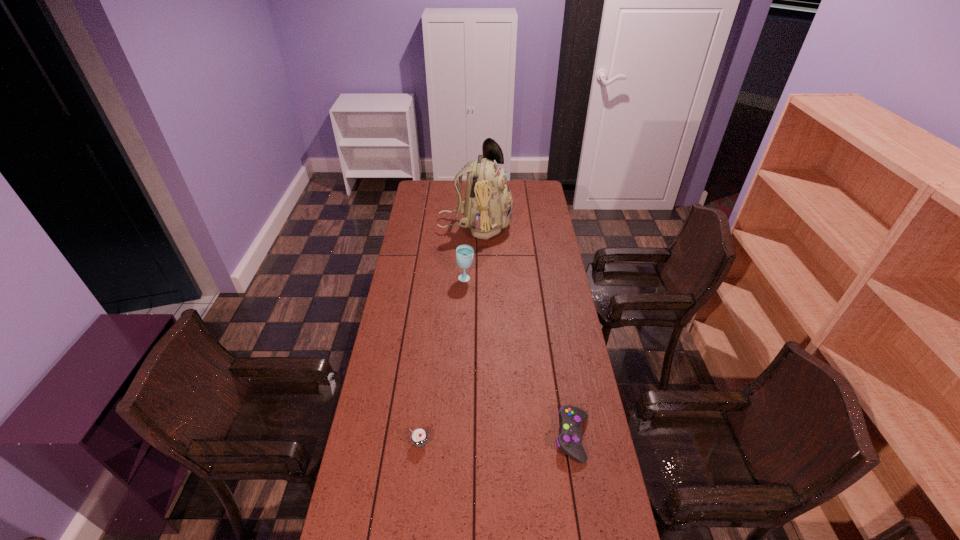
Where is `vacant space located on the back of the rightmost object`? The height and width of the screenshot is (540, 960). vacant space located on the back of the rightmost object is located at coordinates (558, 353).

Find the location of a particular element. Image resolution: width=960 pixels, height=540 pixels. object at the right edge is located at coordinates (569, 441).

What are the coordinates of `free spot at the far edge of the desktop` in the screenshot? It's located at (444, 186).

In the image, there is a desktop. Where is `free space at the left edge`? The image size is (960, 540). free space at the left edge is located at coordinates (366, 437).

Where is `free space at the right edge`? free space at the right edge is located at coordinates (583, 511).

Find the location of `vacant region at the far right corner of the desktop`. vacant region at the far right corner of the desktop is located at coordinates (541, 196).

You are a GUI agent. You are given a task and a screenshot of the screen. Output one action in this format:
    pyautogui.click(x=<x>, y=<y>)
    Task: Click on the free area in between the cupcake and the third nearest object
    
    Given the screenshot: What is the action you would take?
    pyautogui.click(x=443, y=361)

You are a GUI agent. You are given a task and a screenshot of the screen. Output one action in this format:
    pyautogui.click(x=<x>, y=<y>)
    Task: Click on the free point between the rightmost object and the second tallest object
    Image resolution: width=960 pixels, height=540 pixels.
    Given the screenshot: What is the action you would take?
    pyautogui.click(x=519, y=358)

Find the location of a particular element. This screenshot has height=540, width=960. free space between the tallest object and the third tallest object is located at coordinates (447, 334).

Locate an element on the screen. vacant space that's between the control and the tallest object is located at coordinates (524, 332).